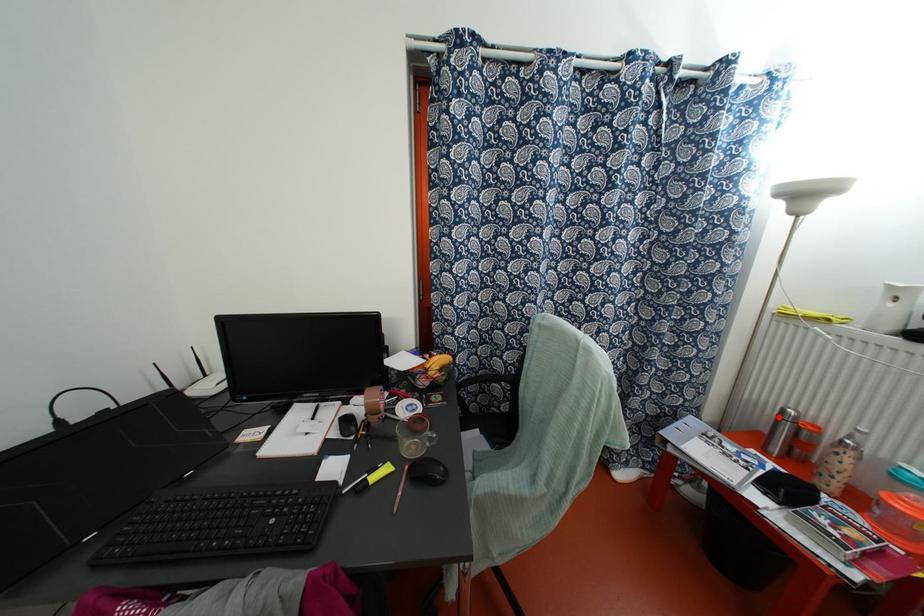
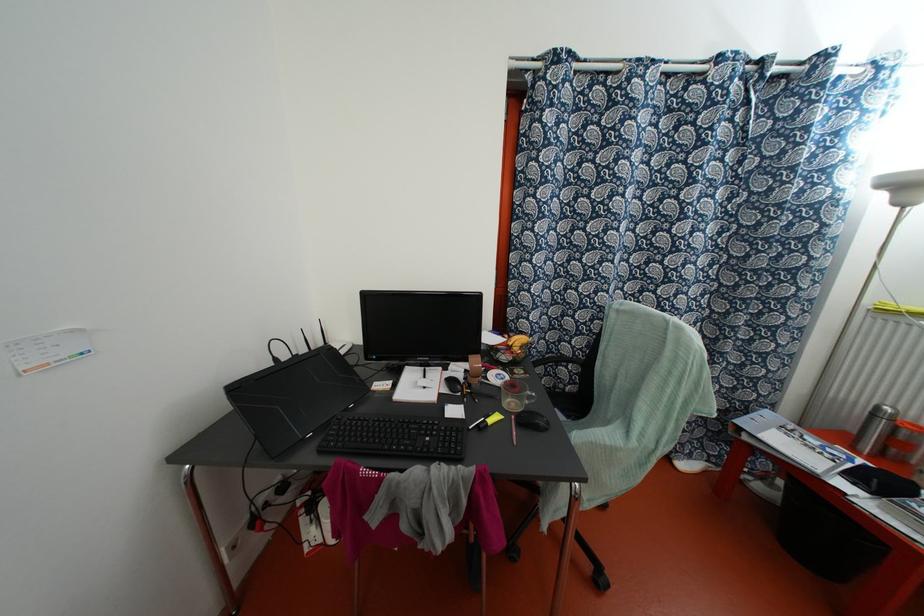
In the second image, find the point that corresponds to the highlighted location in the first image.

(872, 415)